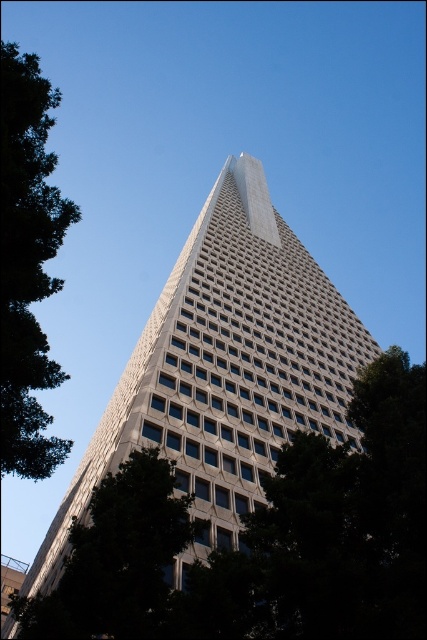
Does green leafy tree at left have a greater height compared to green leafy tree at lower left?

Indeed, green leafy tree at left has a greater height compared to green leafy tree at lower left.

Measure the distance between point (2, 204) and camera.

Point (2, 204) and camera are 19.07 meters apart from each other.

What do you see at coordinates (26, 264) in the screenshot? Image resolution: width=427 pixels, height=640 pixels. I see `green leafy tree at left` at bounding box center [26, 264].

Locate an element on the screen. This screenshot has width=427, height=640. green leafy tree at left is located at coordinates (26, 264).

Is white glass building at center bigger than green leafy tree at lower left?

Yes, white glass building at center is bigger than green leafy tree at lower left.

Does point (259, 292) come farther from viewer compared to point (99, 552)?

Yes.

Where is `white glass building at center`? This screenshot has width=427, height=640. white glass building at center is located at coordinates (225, 369).

The width and height of the screenshot is (427, 640). In order to click on white glass building at center in this screenshot , I will do `click(225, 369)`.

Does point (172, 362) come in front of point (35, 212)?

No, (172, 362) is behind (35, 212).

Who is more distant from viewer, [222,536] or [28,140]?

Point [222,536]

The height and width of the screenshot is (640, 427). Identify the location of white glass building at center. (225, 369).